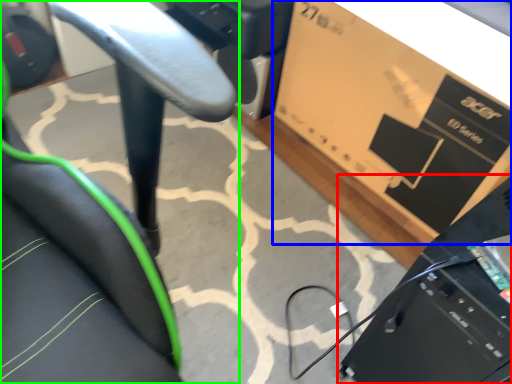
Question: Which object is the closest to the computer (highlighted by a red box)? Choose among these: cardboard box (highlighted by a blue box) or chair (highlighted by a green box).

Choices:
 (A) cardboard box
 (B) chair

Answer: (B)